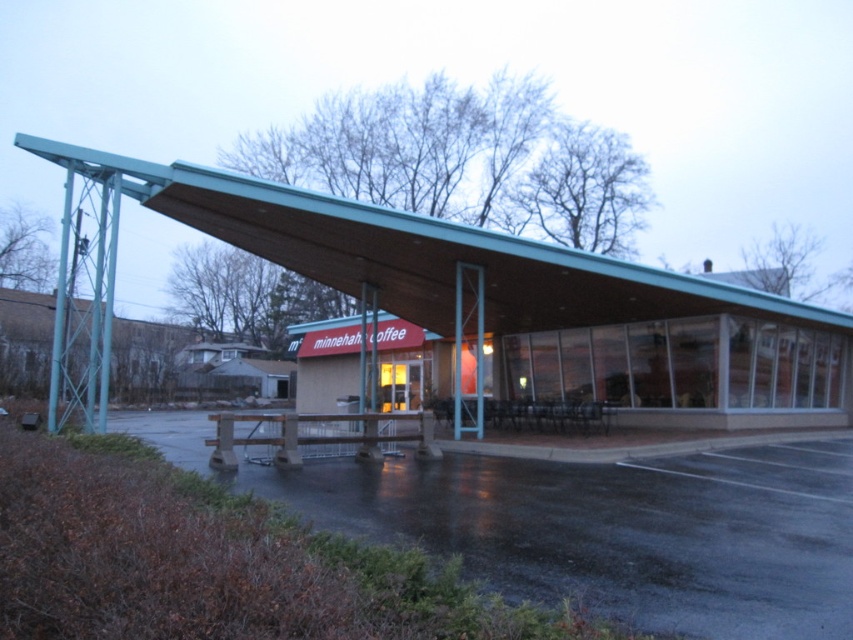
Can you confirm if dark asphalt parking lot at lower left is wider than black plastic picnic table at center?

Yes.

Does dark asphalt parking lot at lower left have a lesser height compared to black plastic picnic table at center?

In fact, dark asphalt parking lot at lower left may be taller than black plastic picnic table at center.

Measure the distance between dark asphalt parking lot at lower left and camera.

The distance of dark asphalt parking lot at lower left from camera is 4.40 meters.

You are a GUI agent. You are given a task and a screenshot of the screen. Output one action in this format:
    pyautogui.click(x=<x>, y=<y>)
    Task: Click on the dark asphalt parking lot at lower left
    
    Given the screenshot: What is the action you would take?
    pyautogui.click(x=616, y=529)

Describe the element at coordinates (426, 257) in the screenshot. The width and height of the screenshot is (853, 640). I see `teal wood shelter at center` at that location.

Which is more to the right, teal wood shelter at center or black plastic picnic table at center?

black plastic picnic table at center is more to the right.

This screenshot has width=853, height=640. What are the coordinates of `teal wood shelter at center` in the screenshot? It's located at [426, 257].

Is dark asphalt parking lot at lower left shorter than teal wood shelter at center?

Correct, dark asphalt parking lot at lower left is not as tall as teal wood shelter at center.

The width and height of the screenshot is (853, 640). What do you see at coordinates (616, 529) in the screenshot?
I see `dark asphalt parking lot at lower left` at bounding box center [616, 529].

The image size is (853, 640). What are the coordinates of `dark asphalt parking lot at lower left` in the screenshot? It's located at (616, 529).